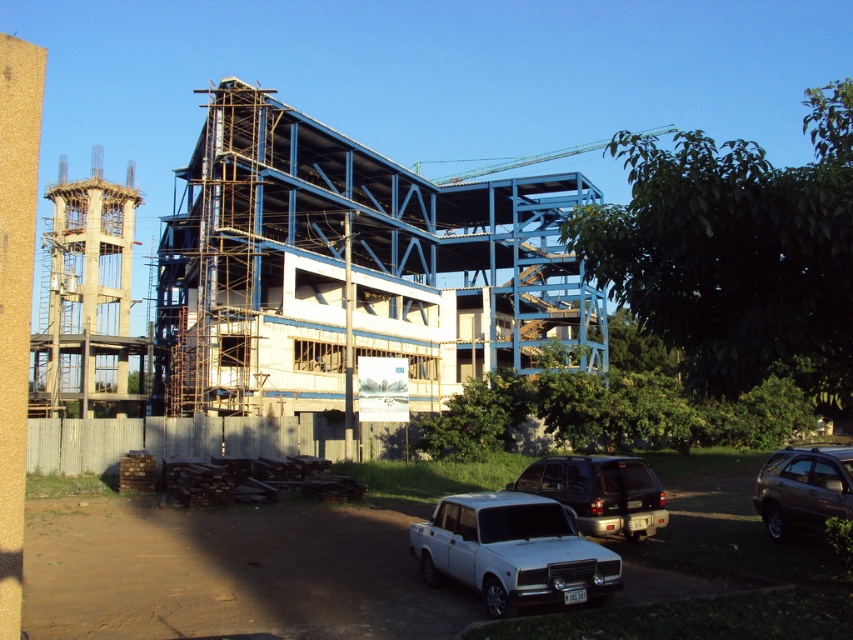
Question: Which object appears farthest from the camera in this image?

Choices:
 (A) white matte sedan at lower center
 (B) dark brown metallic suv at lower right
 (C) matte black suv at center

Answer: (C)

Question: Is white matte sedan at lower center positioned before dark brown metallic suv at lower right?

Choices:
 (A) no
 (B) yes

Answer: (B)

Question: Is white matte sedan at lower center wider than matte black suv at center?

Choices:
 (A) no
 (B) yes

Answer: (A)

Question: Estimate the real-world distances between objects in this image. Which object is closer to the dark brown metallic suv at lower right?

Choices:
 (A) white matte sedan at lower center
 (B) matte black suv at center

Answer: (B)

Question: Among these objects, which one is farthest from the camera?

Choices:
 (A) dark brown metallic suv at lower right
 (B) white matte sedan at lower center

Answer: (A)

Question: Can you confirm if white matte sedan at lower center is positioned above matte black suv at center?

Choices:
 (A) yes
 (B) no

Answer: (A)